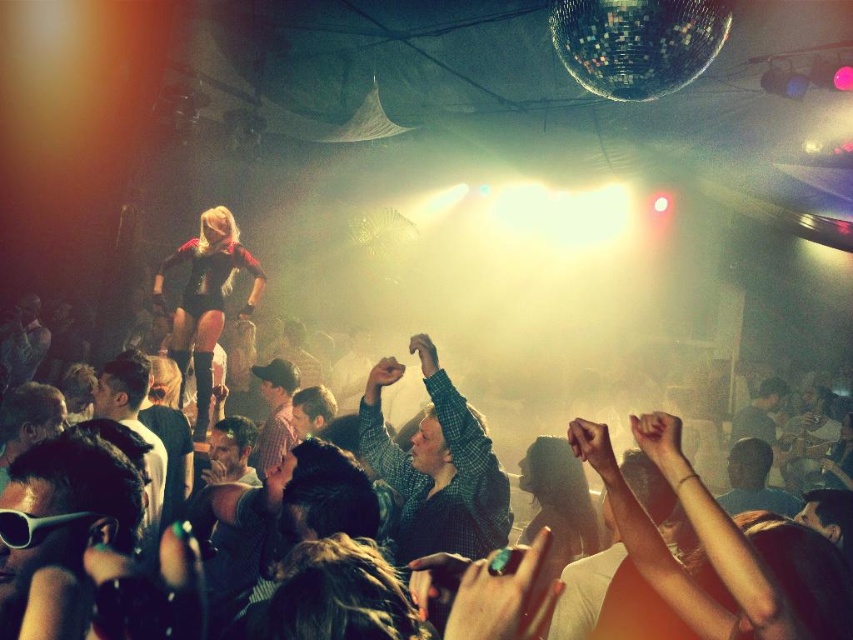
Question: Which of the following is the farthest from the observer?

Choices:
 (A) (183, 356)
 (B) (473, 417)

Answer: (A)

Question: Is green checkered shirt at center thinner than black leather outfit at center?

Choices:
 (A) yes
 (B) no

Answer: (A)

Question: In this image, where is green checkered shirt at center located relative to black leather outfit at center?

Choices:
 (A) right
 (B) left

Answer: (A)

Question: Which of the following is the closest to the observer?

Choices:
 (A) (190, 353)
 (B) (432, 472)

Answer: (B)

Question: Does green checkered shirt at center come in front of black leather outfit at center?

Choices:
 (A) yes
 (B) no

Answer: (A)